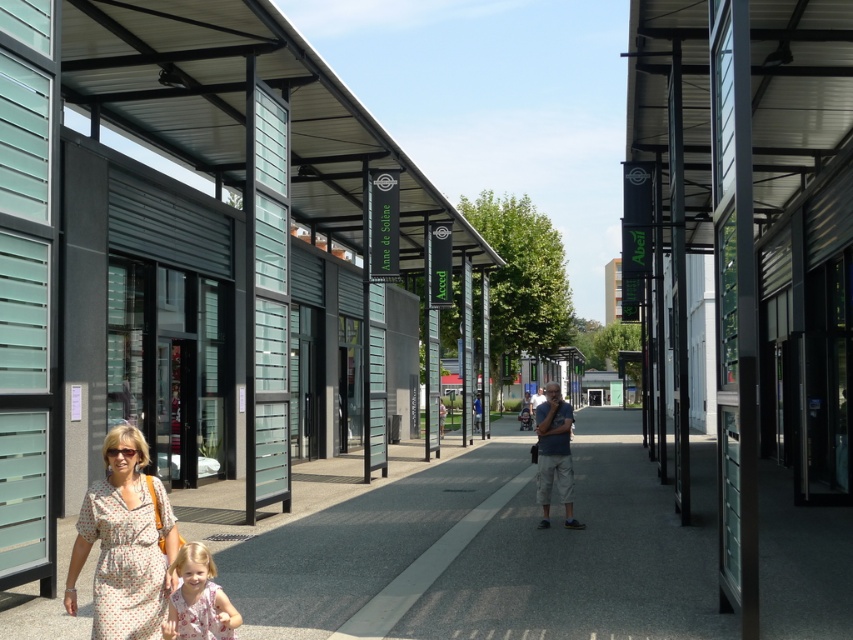
Question: Based on their relative distances, which object is farther from the dotted fabric dress at lower left?

Choices:
 (A) dark gray shirt at center
 (B) matte gray shorts at center

Answer: (A)

Question: Estimate the real-world distances between objects in this image. Which object is farther from the matte gray shorts at center?

Choices:
 (A) dark gray shirt at center
 (B) floral dress at lower left
 (C) dotted fabric dress at lower left
 (D) smooth concrete pavement at lower center

Answer: (A)

Question: Which point is closer to the camera?

Choices:
 (A) (532, 397)
 (B) (537, 412)
 (C) (155, 579)

Answer: (C)

Question: Considering the relative positions of floral dress at lower left and matte gray shorts at center in the image provided, where is floral dress at lower left located with respect to matte gray shorts at center?

Choices:
 (A) right
 (B) left

Answer: (B)

Question: Can you confirm if smooth concrete pavement at lower center is positioned below floral dress at lower left?

Choices:
 (A) no
 (B) yes

Answer: (B)

Question: Is smooth concrete pavement at lower center to the left of dotted fabric dress at lower left from the viewer's perspective?

Choices:
 (A) no
 (B) yes

Answer: (A)